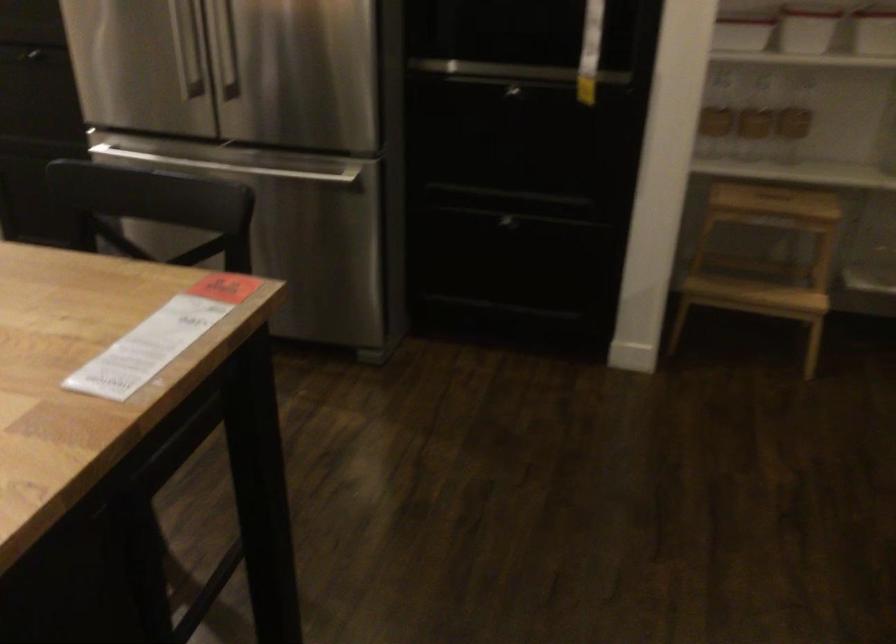
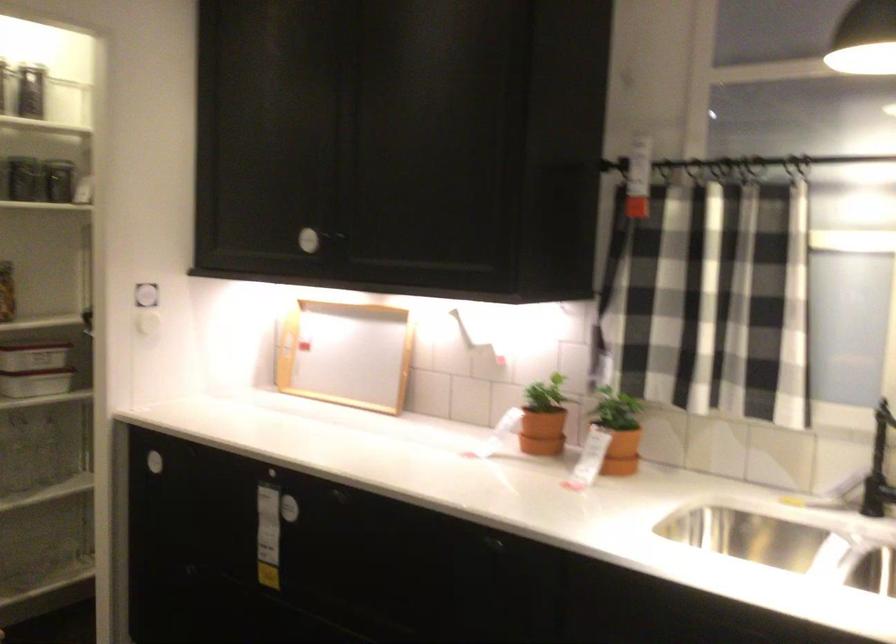
Question: The camera is either moving clockwise (left) or counter-clockwise (right) around the object. The first image is from the beginning of the video and the second image is from the end. Is the camera moving left or right when shooting the video?

Choices:
 (A) Left
 (B) Right

Answer: (A)